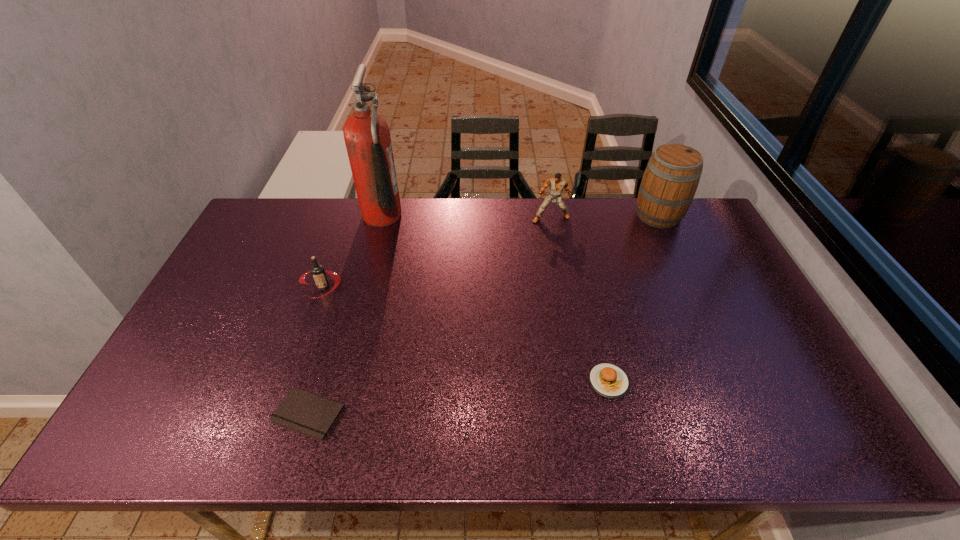
Locate an element on the screen. The image size is (960, 540). the tallest object is located at coordinates (367, 138).

Find the location of a particular element. Image resolution: width=960 pixels, height=540 pixels. cider is located at coordinates (669, 183).

Where is `the second tallest object`? the second tallest object is located at coordinates (669, 183).

You are a GUI agent. You are given a task and a screenshot of the screen. Output one action in this format:
    pyautogui.click(x=<x>, y=<y>)
    Task: Click on the fourth shortest object
    This screenshot has height=540, width=960.
    Given the screenshot: What is the action you would take?
    pyautogui.click(x=557, y=184)

This screenshot has height=540, width=960. What are the coordinates of `the third shortest object` in the screenshot? It's located at (x=318, y=272).

Locate an element on the screen. Image resolution: width=960 pixels, height=540 pixels. the third nearest object is located at coordinates (318, 272).

Identify the location of food. (609, 380).

In order to click on checkbook in this screenshot , I will do `click(301, 411)`.

At what (x,y) coordinates should I click in order to perform the action: click on vacant area located on the front of the tallest object near the operation label. Please return your answer as a coordinate pair (x, y). The width and height of the screenshot is (960, 540). Looking at the image, I should click on (419, 215).

Locate an element on the screen. Image resolution: width=960 pixels, height=540 pixels. free location located on the front of the rightmost object is located at coordinates (694, 292).